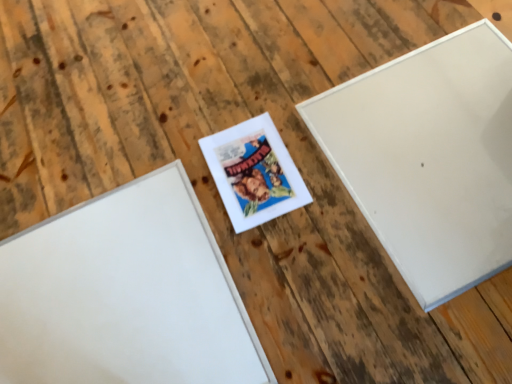
The width and height of the screenshot is (512, 384). In order to click on empty space that is in between white matte picture frame at center, positioned as the 3th picture frame in right-to-left order, and white matte picture frame at upper right, the first picture frame positioned from the right in this screenshot , I will do `click(285, 227)`.